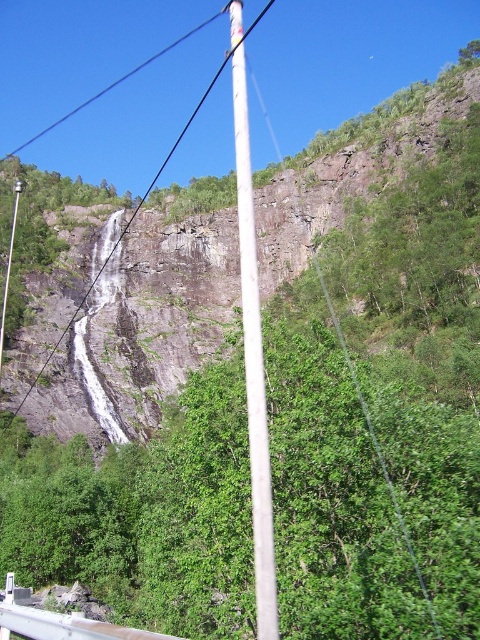
You are standing at the base of the waterfall and want to reach a viewpoint located at point (x=187, y=128). There is an obstacle at point (x=257, y=349). Which point should you avoid to safely reach your destination?

You should avoid the point (x=257, y=349) because it is in front of point (x=187, y=128), meaning it lies along the path to the destination and could block your way.

You are a hiker standing at the base of the waterfall and want to cross the river using a pole. You have two options available, the white smooth pole at center and the white plastic pole at center. If the river is 20 meters wide, which pole would you choose to safely cross?

The white smooth pole at center and white plastic pole at center are 21.07 meters apart from each other. Since the river is 20 meters wide, either pole would be long enough to safely cross the river as both are longer than the river width.